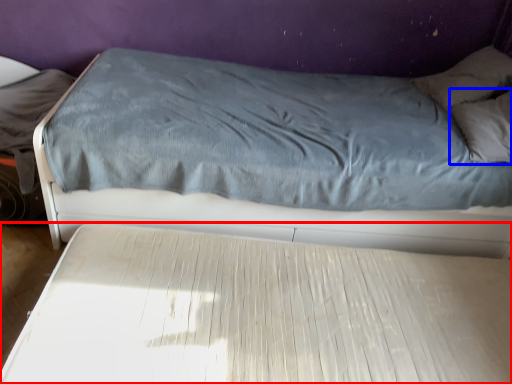
Question: Which point is closer to the camera, bed (highlighted by a red box) or pillow (highlighted by a blue box)?

Choices:
 (A) bed
 (B) pillow

Answer: (A)